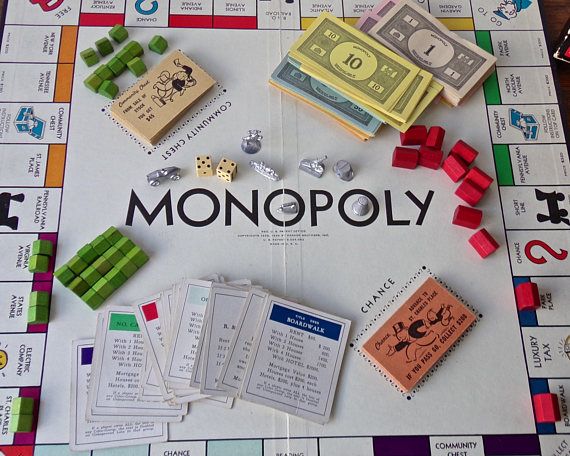
The width and height of the screenshot is (570, 456). What are the coordinates of `monopoly game pieces` in the screenshot? It's located at (258, 137), (158, 173), (268, 170), (287, 206), (317, 166), (337, 169), (357, 207).